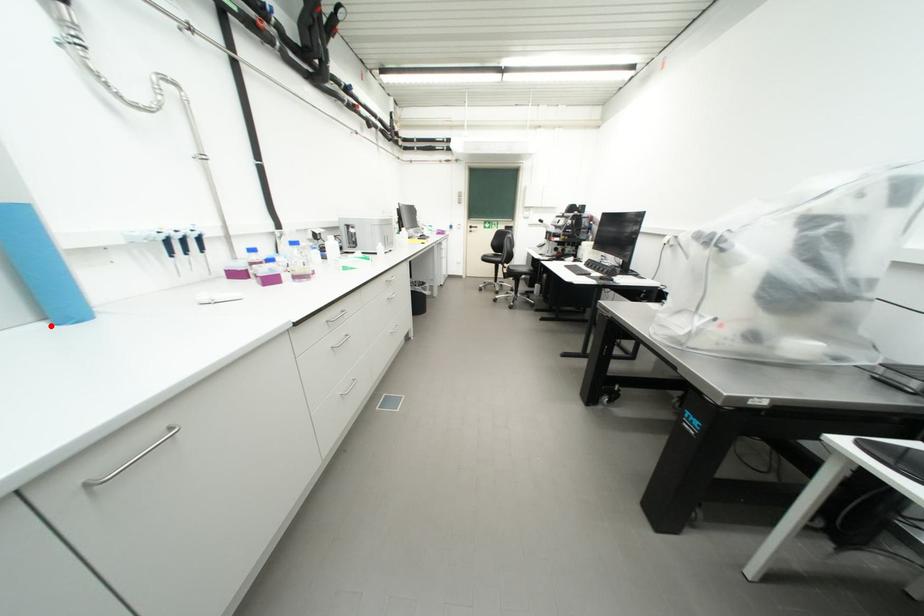
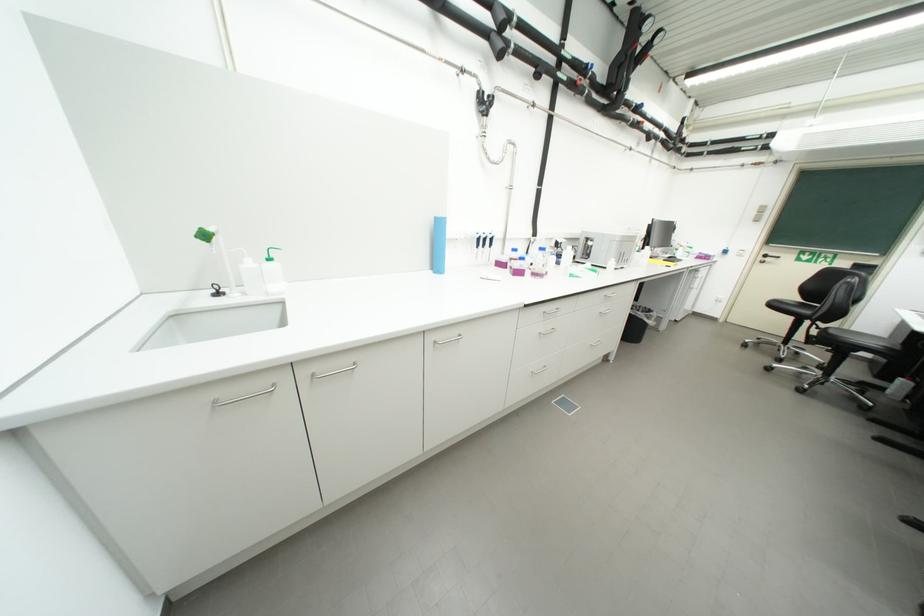
In the second image, find the point that corresponds to the highlighted location in the first image.

(439, 273)